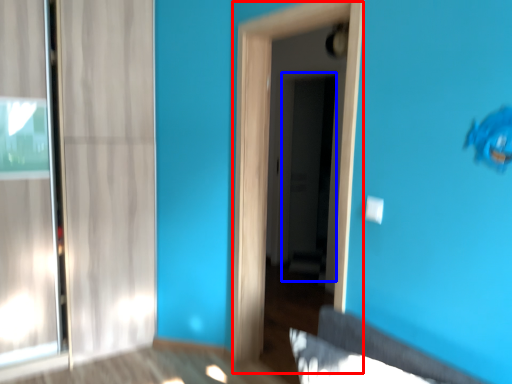
Question: Which object appears closest to the camera in this image, screen door (highlighted by a red box) or screen door (highlighted by a blue box)?

Choices:
 (A) screen door
 (B) screen door

Answer: (A)